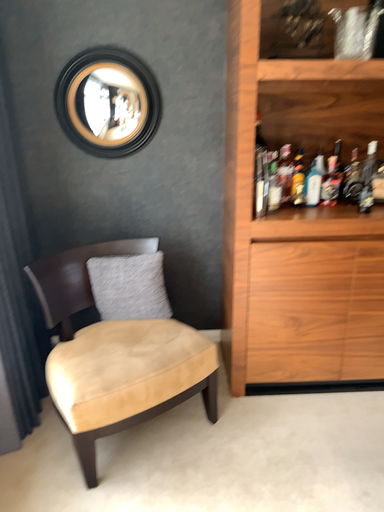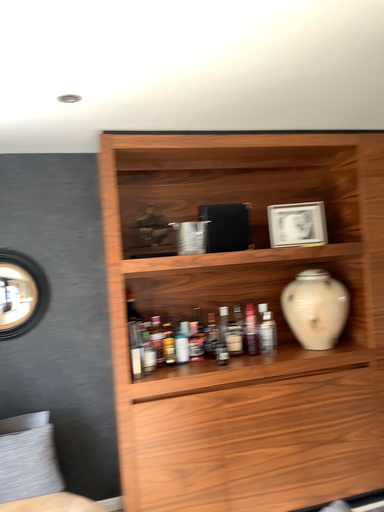
Question: How did the camera likely rotate when shooting the video?

Choices:
 (A) rotated upward
 (B) rotated downward

Answer: (A)